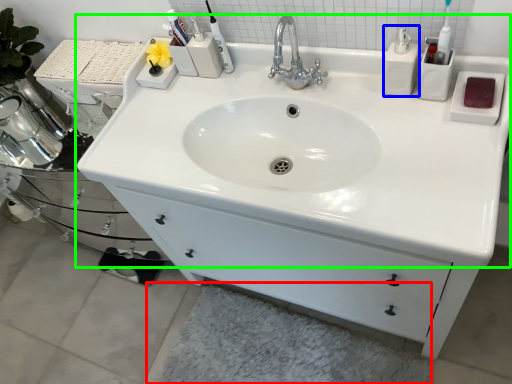
Question: Considering the real-world distances, which object is farthest from bath mat (highlighted by a red box)? soap dispenser (highlighted by a blue box) or sink (highlighted by a green box)?

Choices:
 (A) soap dispenser
 (B) sink

Answer: (A)